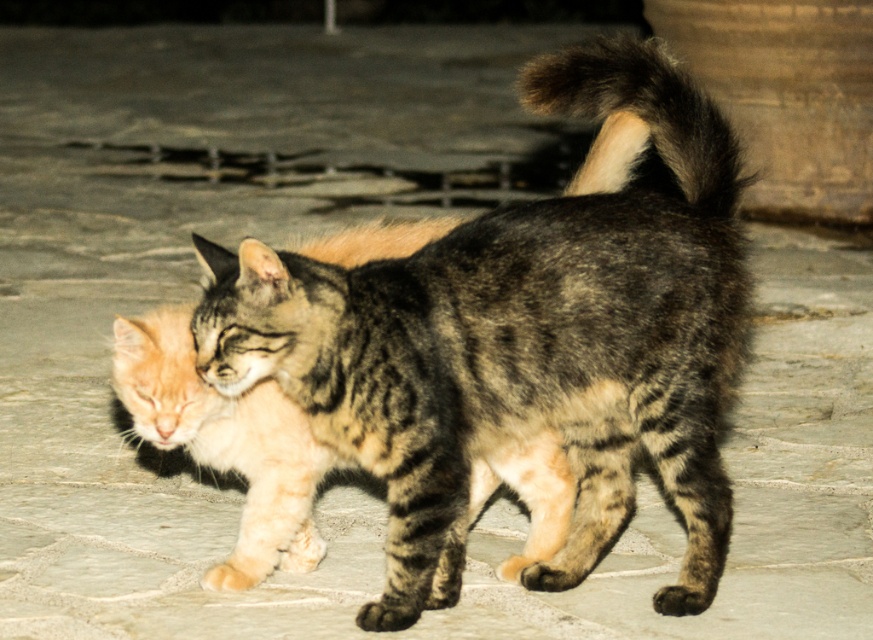
Can you confirm if orange fur cat at center is bigger than dark brown fur tail at upper right?

Yes, orange fur cat at center is bigger than dark brown fur tail at upper right.

Is point (263, 508) behind point (684, 134)?

That is True.

Does point (568, 492) come behind point (672, 141)?

Yes, it is.

Where is `orange fur cat at center`? orange fur cat at center is located at coordinates (225, 442).